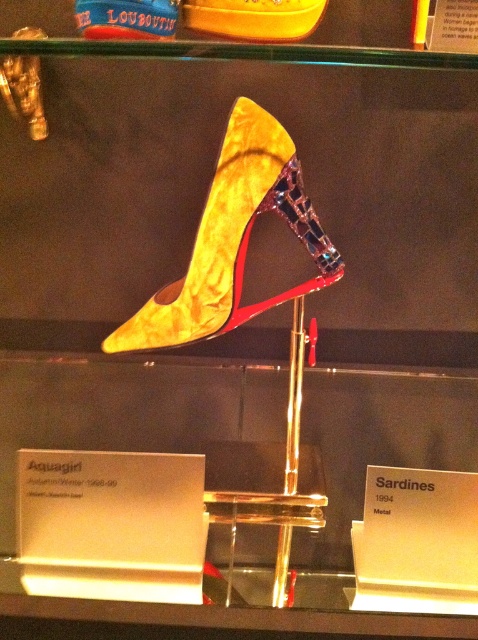
Which of these two, shiny gold shoe at upper center or shiny gold high-heeled shoe at center, stands shorter?

shiny gold shoe at upper center

I want to click on shiny gold shoe at upper center, so click(x=253, y=17).

The image size is (478, 640). Identify the location of shiny gold shoe at upper center. (253, 17).

Who is taller, velvet gold shoe at center or shiny gold shoe at upper center?

velvet gold shoe at center

Between velvet gold shoe at center and shiny gold shoe at upper center, which one appears on the left side from the viewer's perspective?

From the viewer's perspective, velvet gold shoe at center appears more on the left side.

Who is more forward, (206, 202) or (218, 22)?

Point (218, 22) is in front.

You are a GUI agent. You are given a task and a screenshot of the screen. Output one action in this format:
    pyautogui.click(x=<x>, y=<y>)
    Task: Click on the velvet gold shoe at center
    The image size is (478, 640).
    Given the screenshot: What is the action you would take?
    pyautogui.click(x=234, y=240)

Between velvet gold shoe at center and shiny gold high-heeled shoe at center, which one has more height?

velvet gold shoe at center

Does velvet gold shoe at center have a greater height compared to shiny gold high-heeled shoe at center?

Indeed, velvet gold shoe at center has a greater height compared to shiny gold high-heeled shoe at center.

At what (x,y) coordinates should I click in order to perform the action: click on velvet gold shoe at center. Please return your answer as a coordinate pair (x, y). Image resolution: width=478 pixels, height=640 pixels. Looking at the image, I should click on (234, 240).